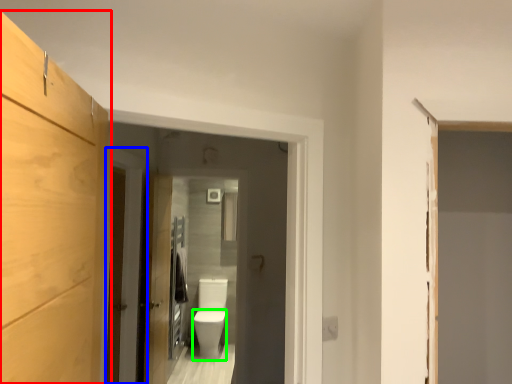
Question: Which object is the farthest from cabinetry (highlighted by a red box)? Choose among these: door (highlighted by a blue box) or toilet bowl (highlighted by a green box).

Choices:
 (A) door
 (B) toilet bowl

Answer: (B)